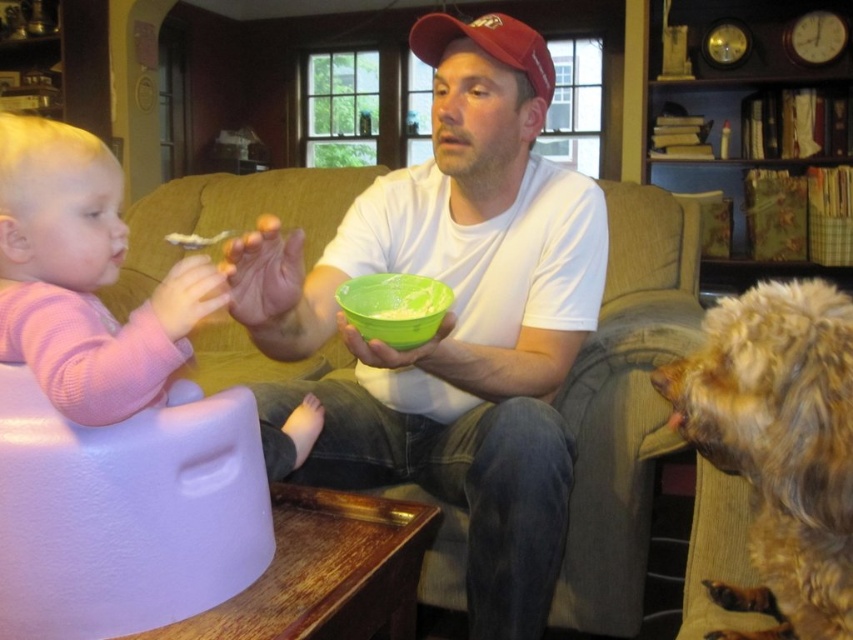
Does white matte shirt at center appear on the left side of fuzzy brown fur at lower right?

Indeed, white matte shirt at center is positioned on the left side of fuzzy brown fur at lower right.

Does point (415, 476) come farther from viewer compared to point (822, 468)?

Yes, it is.

Identify the location of white matte shirt at center. This screenshot has height=640, width=853. (454, 317).

Can you confirm if white matte shirt at center is taller than green matte bowl at center?

Correct, white matte shirt at center is much taller as green matte bowl at center.

Which of these two, white matte shirt at center or green matte bowl at center, stands taller?

white matte shirt at center is taller.

Image resolution: width=853 pixels, height=640 pixels. I want to click on white matte shirt at center, so (x=454, y=317).

In order to click on white matte shirt at center in this screenshot , I will do `click(454, 317)`.

Which of these two, green plastic bowl at center or green matte bowl at center, stands shorter?

green matte bowl at center is shorter.

Describe the element at coordinates (393, 307) in the screenshot. I see `green plastic bowl at center` at that location.

Which is behind, point (380, 332) or point (374, 317)?

The point (380, 332) is more distant.

Where is `green plastic bowl at center`? green plastic bowl at center is located at coordinates (393, 307).